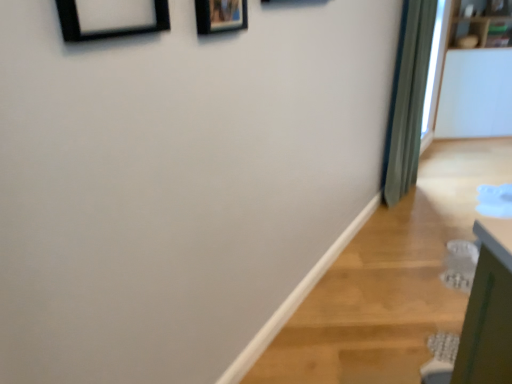
Question: Is wooden picture frame at upper center, placed as the second picture frame when sorted from front to back, to the left of green fabric curtain at right from the viewer's perspective?

Choices:
 (A) yes
 (B) no

Answer: (A)

Question: Is the depth of wooden picture frame at upper center, placed as the second picture frame when sorted from front to back, greater than that of green fabric curtain at right?

Choices:
 (A) yes
 (B) no

Answer: (B)

Question: Considering the relative sizes of wooden picture frame at upper center, placed as the second picture frame when sorted from front to back, and green fabric curtain at right in the image provided, is wooden picture frame at upper center, placed as the second picture frame when sorted from front to back, wider than green fabric curtain at right?

Choices:
 (A) no
 (B) yes

Answer: (A)

Question: Is wooden picture frame at upper center, which is counted as the 1th picture frame, starting from the back, looking in the opposite direction of green fabric curtain at right?

Choices:
 (A) yes
 (B) no

Answer: (B)

Question: From the image's perspective, would you say wooden picture frame at upper center, which is counted as the 1th picture frame, starting from the back, is positioned over green fabric curtain at right?

Choices:
 (A) no
 (B) yes

Answer: (A)

Question: Is wooden picture frame at upper center, placed as the second picture frame when sorted from front to back, directly adjacent to green fabric curtain at right?

Choices:
 (A) yes
 (B) no

Answer: (B)

Question: From a real-world perspective, is green fabric curtain at right beneath black matte picture frame at upper left, marked as the 1th picture frame in a front-to-back arrangement?

Choices:
 (A) no
 (B) yes

Answer: (B)

Question: Can you confirm if green fabric curtain at right is thinner than black matte picture frame at upper left, marked as the 1th picture frame in a front-to-back arrangement?

Choices:
 (A) yes
 (B) no

Answer: (B)

Question: Is green fabric curtain at right wider than black matte picture frame at upper left, marked as the 1th picture frame in a front-to-back arrangement?

Choices:
 (A) yes
 (B) no

Answer: (A)

Question: Is green fabric curtain at right positioned with its back to black matte picture frame at upper left, placed as the 2th picture frame when sorted from back to front?

Choices:
 (A) yes
 (B) no

Answer: (B)

Question: Does green fabric curtain at right touch black matte picture frame at upper left, marked as the 1th picture frame in a front-to-back arrangement?

Choices:
 (A) yes
 (B) no

Answer: (B)

Question: Can you confirm if green fabric curtain at right is positioned to the right of black matte picture frame at upper left, marked as the 1th picture frame in a front-to-back arrangement?

Choices:
 (A) no
 (B) yes

Answer: (B)

Question: Is wooden picture frame at upper center, acting as the 1th picture frame starting from the right, shorter than black matte picture frame at upper left, acting as the 2th picture frame starting from the right?

Choices:
 (A) yes
 (B) no

Answer: (B)